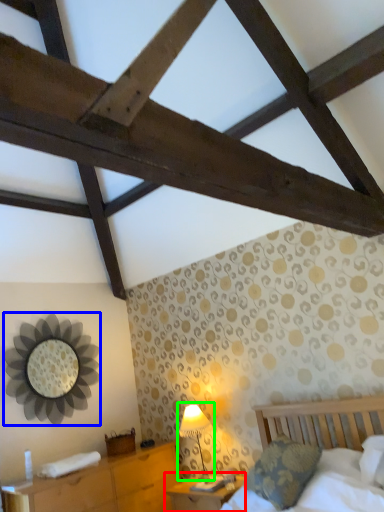
Question: Which is nearer to the nightstand (highlighted by a red box)? mirror (highlighted by a blue box) or table lamp (highlighted by a green box).

Choices:
 (A) mirror
 (B) table lamp

Answer: (B)